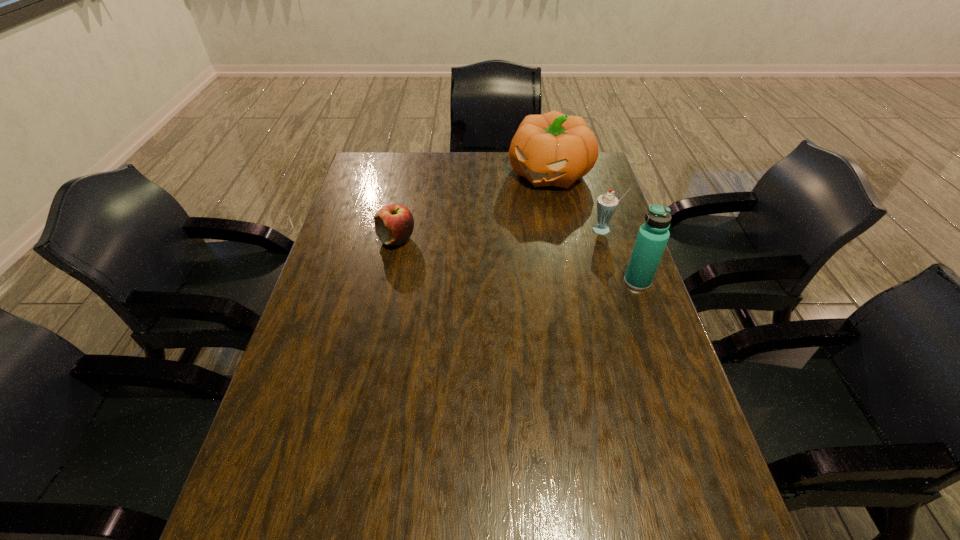
Where is `the shortest object`? The image size is (960, 540). the shortest object is located at coordinates (394, 223).

This screenshot has height=540, width=960. Identify the location of the leftmost object. (394, 223).

Locate an element on the screen. the nearest object is located at coordinates (653, 235).

Identify the location of milkshake. (607, 203).

Identify the location of the farthest object. (552, 149).

The height and width of the screenshot is (540, 960). I want to click on vacant space located on the bitten side of the leftmost object, so click(351, 240).

Identify the location of vacant region located 0.280m on the left of the nearest object. The width and height of the screenshot is (960, 540). (525, 281).

Locate an element on the screen. The image size is (960, 540). vacant space located on the straw side of the milkshake is located at coordinates (545, 260).

The image size is (960, 540). Find the location of `blank space located on the straw side of the milkshake`. blank space located on the straw side of the milkshake is located at coordinates (511, 278).

Where is `vacant space situated on the straw side of the milkshake`? Image resolution: width=960 pixels, height=540 pixels. vacant space situated on the straw side of the milkshake is located at coordinates (493, 287).